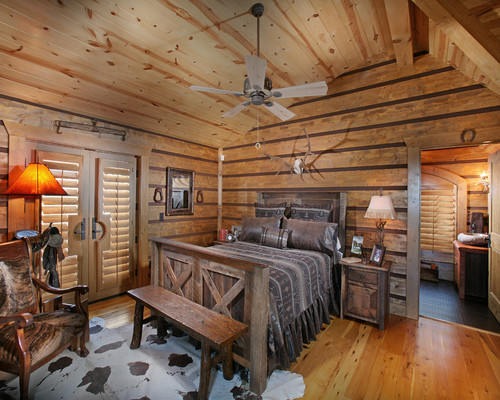
Identify the location of drawer. (364, 285).